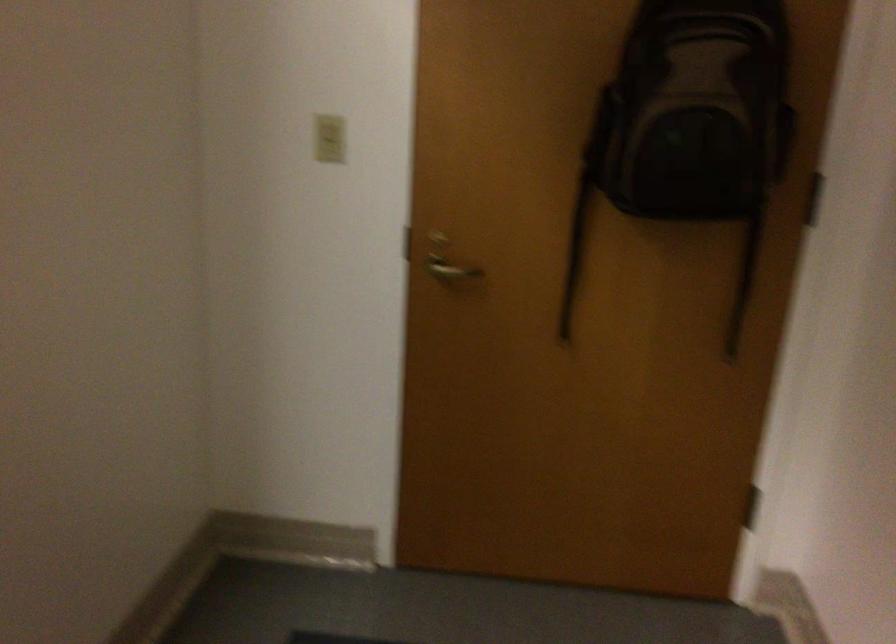
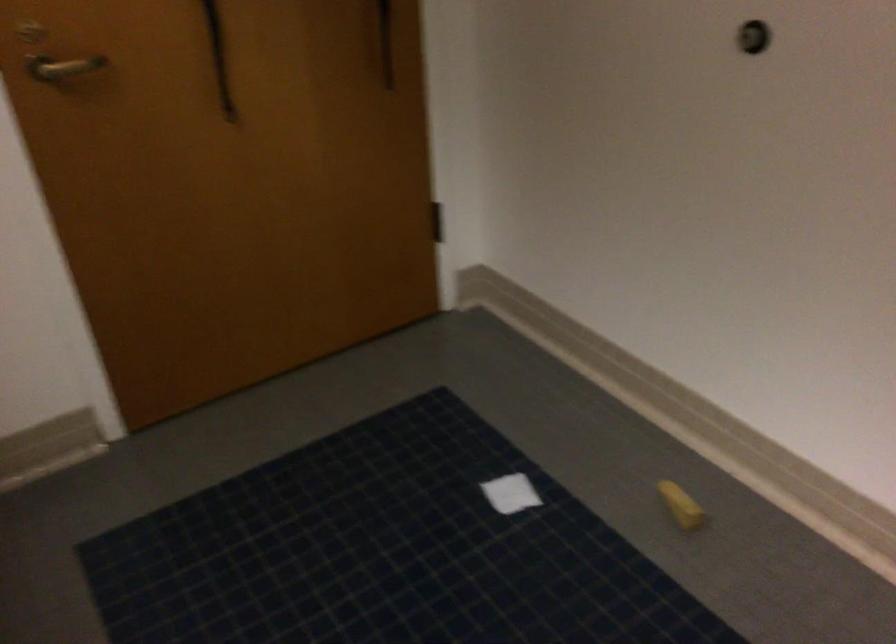
In the second image, find the point that corresponds to point 435,269 in the first image.

(62, 67)